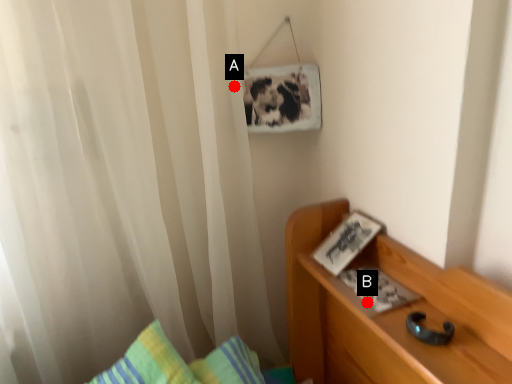
Question: Two points are circled on the image, labeled by A and B beside each circle. Which point is farther from the camera taking this photo?

Choices:
 (A) A is further
 (B) B is further

Answer: (A)